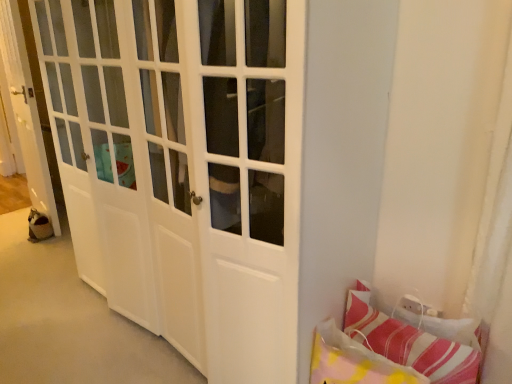
Question: Would you say white glossy door at left is outside striped fabric pillow at lower right, which is the 1th pillow from left to right?

Choices:
 (A) yes
 (B) no

Answer: (A)

Question: Considering the relative sizes of white glossy door at left and striped fabric pillow at lower right, which is the 1th pillow from left to right, in the image provided, is white glossy door at left thinner than striped fabric pillow at lower right, which is the 1th pillow from left to right,?

Choices:
 (A) no
 (B) yes

Answer: (A)

Question: Is white glossy door at left positioned in front of striped fabric pillow at lower right, which is the 1th pillow from left to right?

Choices:
 (A) no
 (B) yes

Answer: (A)

Question: Are white glossy door at left and striped fabric pillow at lower right, which is the 1th pillow from left to right, located far from each other?

Choices:
 (A) yes
 (B) no

Answer: (A)

Question: Is white glossy door at left looking in the opposite direction of striped fabric pillow at lower right, which is the 1th pillow from left to right?

Choices:
 (A) no
 (B) yes

Answer: (A)

Question: In terms of size, does striped fabric pillow at lower right, which appears as the 1th pillow when viewed from the right, appear bigger or smaller than striped fabric pillow at lower right, which ranks as the second pillow in right-to-left order?

Choices:
 (A) big
 (B) small

Answer: (A)

Question: Considering the positions of point pyautogui.click(x=422, y=369) and point pyautogui.click(x=357, y=357), is point pyautogui.click(x=422, y=369) closer or farther from the camera than point pyautogui.click(x=357, y=357)?

Choices:
 (A) closer
 (B) farther

Answer: (A)

Question: Is striped fabric pillow at lower right, which appears as the 1th pillow when viewed from the right, situated inside striped fabric pillow at lower right, which is the 1th pillow from left to right, or outside?

Choices:
 (A) inside
 (B) outside

Answer: (B)

Question: Is striped fabric pillow at lower right, the 2th pillow in the left-to-right sequence, taller or shorter than striped fabric pillow at lower right, which is the 1th pillow from left to right?

Choices:
 (A) tall
 (B) short

Answer: (A)

Question: Does point click(x=6, y=24) appear closer or farther from the camera than point click(x=385, y=317)?

Choices:
 (A) closer
 (B) farther

Answer: (B)

Question: From a real-world perspective, is white glossy door at left positioned above or below striped fabric pillow at lower right, which appears as the 1th pillow when viewed from the right?

Choices:
 (A) below
 (B) above

Answer: (B)

Question: Is white glossy door at left bigger or smaller than striped fabric pillow at lower right, the 2th pillow in the left-to-right sequence?

Choices:
 (A) big
 (B) small

Answer: (A)

Question: Considering the relative positions of white glossy door at left and striped fabric pillow at lower right, which appears as the 1th pillow when viewed from the right, in the image provided, is white glossy door at left to the left or to the right of striped fabric pillow at lower right, which appears as the 1th pillow when viewed from the right,?

Choices:
 (A) right
 (B) left

Answer: (B)

Question: In terms of size, does striped fabric pillow at lower right, which ranks as the second pillow in right-to-left order, appear bigger or smaller than striped fabric pillow at lower right, which appears as the 1th pillow when viewed from the right?

Choices:
 (A) big
 (B) small

Answer: (B)

Question: Relative to striped fabric pillow at lower right, which appears as the 1th pillow when viewed from the right, is striped fabric pillow at lower right, which is the 1th pillow from left to right, in front or behind?

Choices:
 (A) behind
 (B) front

Answer: (B)